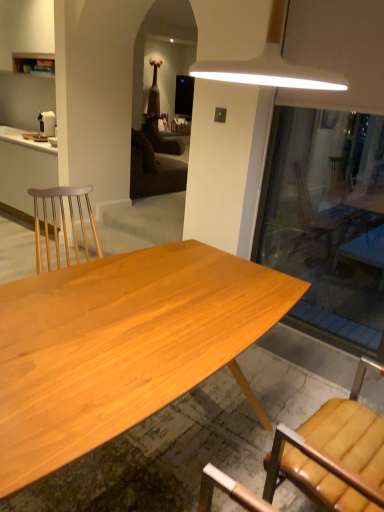
Question: Considering the relative positions of matte white cabinet at left and natural wood desk at center in the image provided, is matte white cabinet at left to the left or to the right of natural wood desk at center?

Choices:
 (A) right
 (B) left

Answer: (B)

Question: From their relative heights in the image, would you say matte white cabinet at left is taller or shorter than natural wood desk at center?

Choices:
 (A) tall
 (B) short

Answer: (A)

Question: Which object is the closest to the natural wood desk at center?

Choices:
 (A) matte white cabinet at left
 (B) transparent glass door at right
 (C) brown leather chair at lower right
 (D) white plastic coffee maker at left

Answer: (C)

Question: Which object is positioned closest to the matte white cabinet at left?

Choices:
 (A) natural wood desk at center
 (B) transparent glass door at right
 (C) white plastic coffee maker at left
 (D) brown leather chair at lower right

Answer: (C)